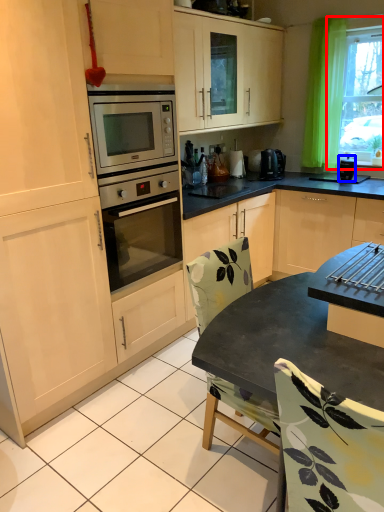
Question: Which object appears farthest to the camera in this image, window (highlighted by a red box) or appliance (highlighted by a blue box)?

Choices:
 (A) window
 (B) appliance

Answer: (B)